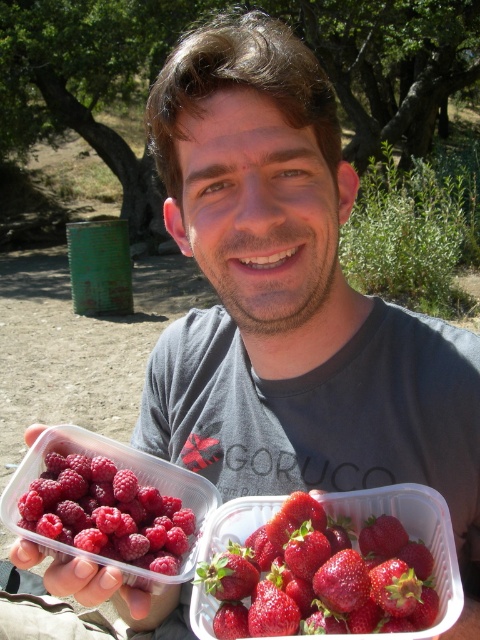
Question: Is raspberry matte at left below shiny red strawberries at center?

Choices:
 (A) no
 (B) yes

Answer: (A)

Question: Is raspberry matte at left closer to the viewer compared to shiny red strawberries at center?

Choices:
 (A) no
 (B) yes

Answer: (A)

Question: Can you confirm if raspberry matte at left is wider than shiny red strawberries at center?

Choices:
 (A) yes
 (B) no

Answer: (B)

Question: Which point is farther to the camera?

Choices:
 (A) shiny red strawberries at center
 (B) raspberry matte at left

Answer: (B)

Question: Which point is farther to the camera?

Choices:
 (A) (60, 536)
 (B) (226, 538)

Answer: (B)

Question: Which point is farther from the camera taking this photo?

Choices:
 (A) (216, 552)
 (B) (48, 492)

Answer: (A)